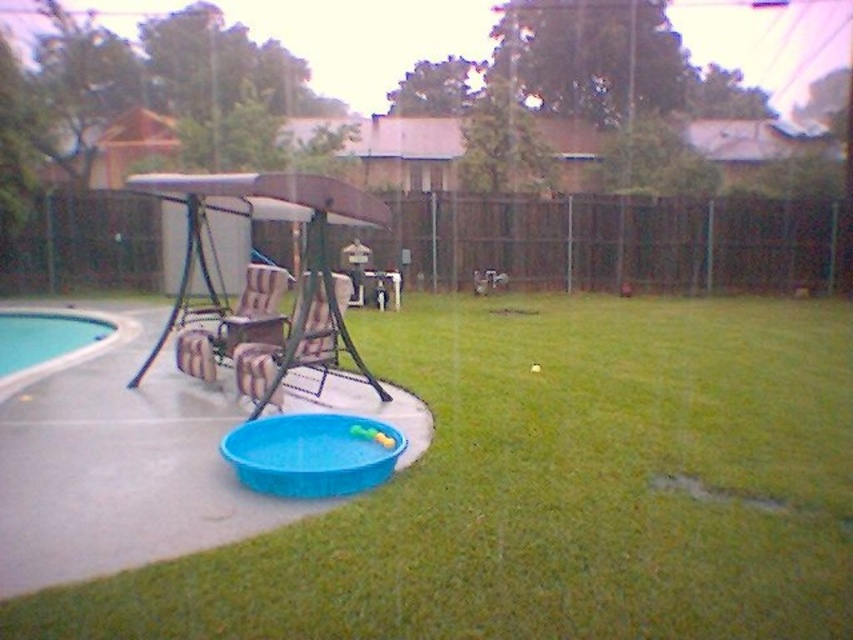
You are standing in the backyard and want to walk from the white smooth pool at lower left to the brown woven chair at center. Which direction should you move to get closer to the chair?

You should move away from the viewer since the white smooth pool at lower left is closer to you than the brown woven chair at center.

You are a parent trying to place a new toy on the ground between the green grass at center and the brown woven chair at center. Which object should you place it closer to so that it is on the ground?

The green grass at center is below brown woven chair at center, so placing the toy closer to the green grass at center ensures it stays on the ground.

You are standing in the backyard and want to place a small garden gnome between the two points marked as point (12, 355) and point (236, 340). Which point should the gnome be closer to if you want it to be nearer to the camera?

The gnome should be placed closer to point (12, 355) because it is further to the camera than point (236, 340).